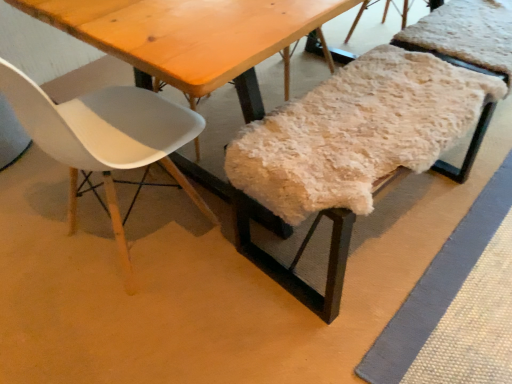
Question: From the image's perspective, would you say fuzzy woolen bench at center, the 1th chair from the right, is positioned over white matte plastic chair at left, which ranks as the first chair in left-to-right order?

Choices:
 (A) no
 (B) yes

Answer: (A)

Question: From a real-world perspective, is fuzzy woolen bench at center, marked as the 2th chair in a left-to-right arrangement, on white matte plastic chair at left, positioned as the second chair in right-to-left order?

Choices:
 (A) yes
 (B) no

Answer: (B)

Question: Is white matte plastic chair at left, which ranks as the first chair in left-to-right order, surrounded by fuzzy woolen bench at center, marked as the 2th chair in a left-to-right arrangement?

Choices:
 (A) yes
 (B) no

Answer: (B)

Question: Does fuzzy woolen bench at center, marked as the 2th chair in a left-to-right arrangement, lie behind white matte plastic chair at left, positioned as the second chair in right-to-left order?

Choices:
 (A) yes
 (B) no

Answer: (A)

Question: Does fuzzy woolen bench at center, marked as the 2th chair in a left-to-right arrangement, lie in front of white matte plastic chair at left, which ranks as the first chair in left-to-right order?

Choices:
 (A) yes
 (B) no

Answer: (B)

Question: Does fuzzy woolen bench at center, marked as the 2th chair in a left-to-right arrangement, have a greater height compared to white matte plastic chair at left, which ranks as the first chair in left-to-right order?

Choices:
 (A) yes
 (B) no

Answer: (B)

Question: Is white matte plastic chair at left, positioned as the second chair in right-to-left order, oriented away from fuzzy woolen bench at center, the 1th chair from the right?

Choices:
 (A) yes
 (B) no

Answer: (B)

Question: From the image's perspective, is white matte plastic chair at left, which ranks as the first chair in left-to-right order, under fuzzy woolen bench at center, marked as the 2th chair in a left-to-right arrangement?

Choices:
 (A) no
 (B) yes

Answer: (A)

Question: From a real-world perspective, does white matte plastic chair at left, which ranks as the first chair in left-to-right order, stand above fuzzy woolen bench at center, the 1th chair from the right?

Choices:
 (A) yes
 (B) no

Answer: (A)

Question: Does white matte plastic chair at left, positioned as the second chair in right-to-left order, turn towards fuzzy woolen bench at center, the 1th chair from the right?

Choices:
 (A) yes
 (B) no

Answer: (B)

Question: Can we say white matte plastic chair at left, positioned as the second chair in right-to-left order, lies outside fuzzy woolen bench at center, marked as the 2th chair in a left-to-right arrangement?

Choices:
 (A) yes
 (B) no

Answer: (A)

Question: Can you confirm if white matte plastic chair at left, positioned as the second chair in right-to-left order, is wider than fuzzy woolen bench at center, marked as the 2th chair in a left-to-right arrangement?

Choices:
 (A) no
 (B) yes

Answer: (B)

Question: Is fuzzy woolen bench at center, marked as the 2th chair in a left-to-right arrangement, bigger or smaller than white matte plastic chair at left, which ranks as the first chair in left-to-right order?

Choices:
 (A) big
 (B) small

Answer: (B)